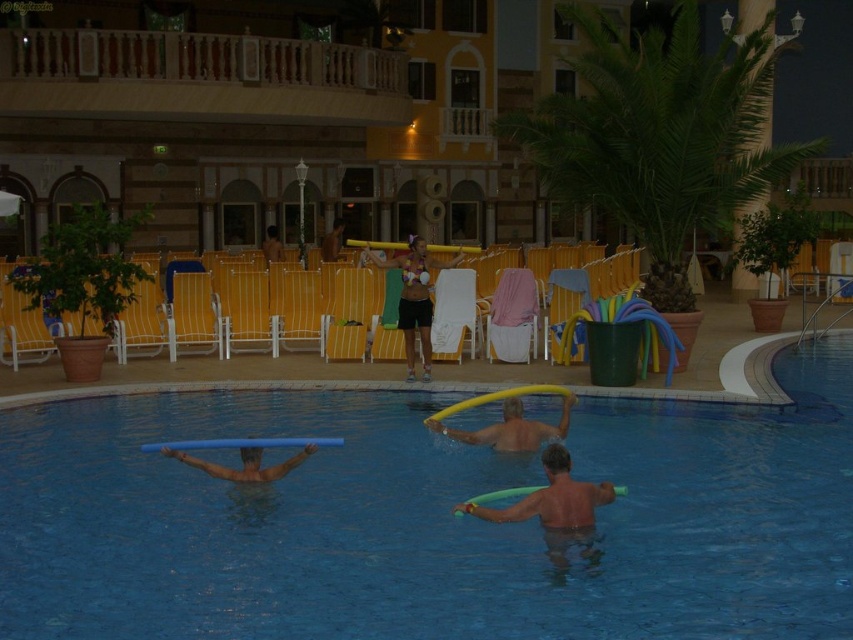
Question: Which point appears farthest from the camera in this image?

Choices:
 (A) (258, 472)
 (B) (564, 419)

Answer: (B)

Question: Which point appears farthest from the camera in this image?

Choices:
 (A) (328, 257)
 (B) (380, 260)
 (C) (419, 492)

Answer: (A)

Question: Is matte bikini top at center smaller than matte black bikini at center?

Choices:
 (A) no
 (B) yes

Answer: (A)

Question: Can you confirm if matte bikini top at center is positioned to the right of yellow foam at upper center?

Choices:
 (A) no
 (B) yes

Answer: (A)

Question: Which object is closer to the camera taking this photo?

Choices:
 (A) blue rubber ring at center
 (B) blue rubber tube at center
 (C) yellow foam at upper center

Answer: (A)

Question: Is matte bikini top at center smaller than matte yellow pool noodle at center?

Choices:
 (A) no
 (B) yes

Answer: (A)